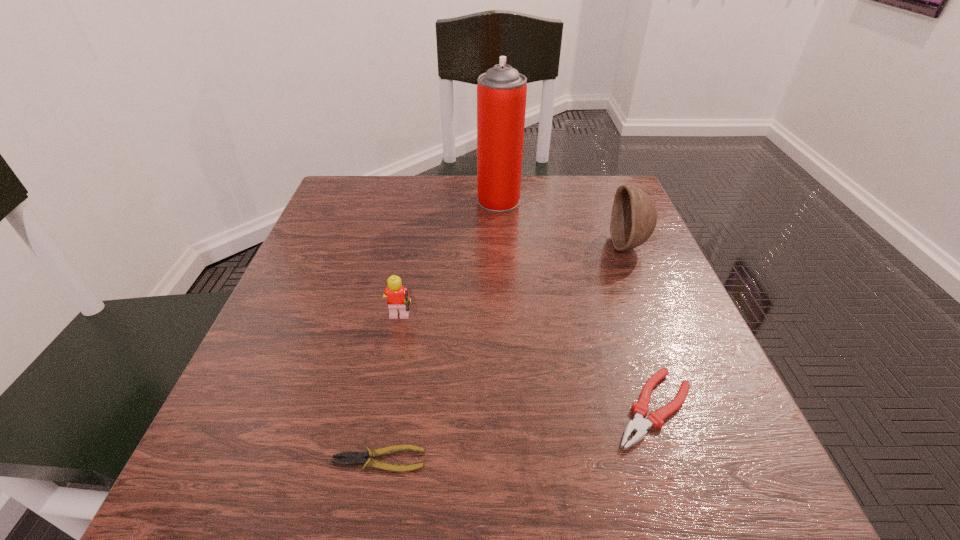
The width and height of the screenshot is (960, 540). Find the location of `vacant space located on the front of the aerosol can`. vacant space located on the front of the aerosol can is located at coordinates (503, 277).

Where is `vacant space located 0.190m on the front of the bowl`? The height and width of the screenshot is (540, 960). vacant space located 0.190m on the front of the bowl is located at coordinates (665, 334).

Where is `free space located 0.260m in front of the third farthest object with the accessory visible`? free space located 0.260m in front of the third farthest object with the accessory visible is located at coordinates (559, 321).

The width and height of the screenshot is (960, 540). In order to click on vacant space located on the back of the taller pliers in this screenshot , I will do `click(597, 242)`.

Identify the location of vacant space located on the right of the shortest object. This screenshot has width=960, height=540. (710, 460).

This screenshot has width=960, height=540. What are the coordinates of `object situated at the far edge` in the screenshot? It's located at pos(501,92).

At what (x,y) coordinates should I click in order to perform the action: click on bowl that is at the right edge. Please return your answer as a coordinate pair (x, y). The height and width of the screenshot is (540, 960). Looking at the image, I should click on (634, 216).

Where is `pliers located in the right edge section of the desktop`? This screenshot has width=960, height=540. pliers located in the right edge section of the desktop is located at coordinates (639, 424).

This screenshot has height=540, width=960. Identify the location of object at the near right corner. (639, 424).

The height and width of the screenshot is (540, 960). Find the location of `free region at the far edge of the desktop`. free region at the far edge of the desktop is located at coordinates 558,226.